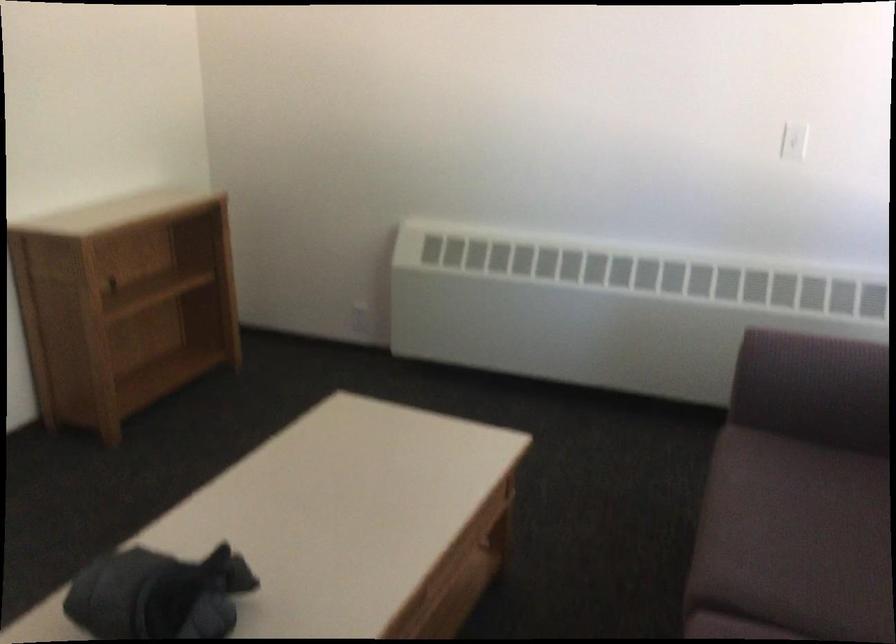
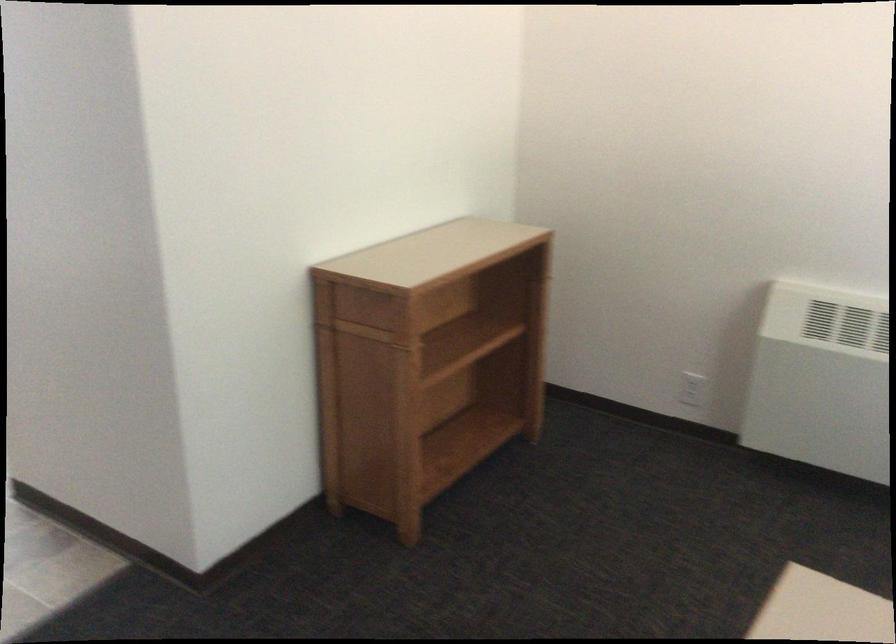
Locate, in the second image, the point that corresponds to (x=362, y=319) in the first image.

(692, 389)